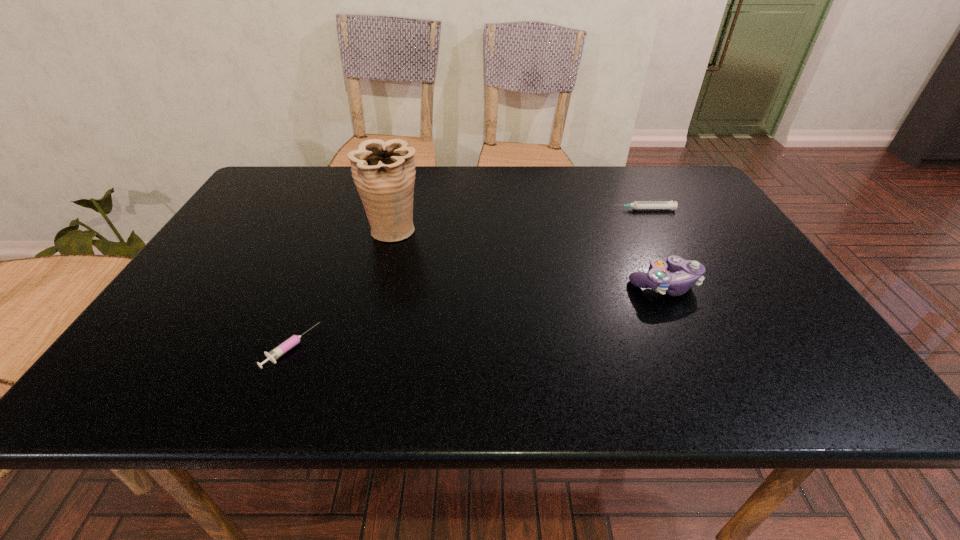
You are a GUI agent. You are given a task and a screenshot of the screen. Output one action in this format:
    pyautogui.click(x=<x>, y=<y>)
    Task: Click on the free space between the farther syringe and the nearest object
    Image resolution: width=960 pixels, height=540 pixels.
    Given the screenshot: What is the action you would take?
    pyautogui.click(x=468, y=278)

Select which object appears as the closest to the third shortest object. Please provide its 2D coordinates. Your answer should be formatted as a tuple, i.e. [(x, y)], where the tuple contains the x and y coordinates of a point satisfying the conditions above.

[(672, 205)]

At what (x,y) coordinates should I click in order to perform the action: click on the second closest object to the shortest object. Please return your answer as a coordinate pair (x, y). The width and height of the screenshot is (960, 540). Looking at the image, I should click on (685, 273).

You are a GUI agent. You are given a task and a screenshot of the screen. Output one action in this format:
    pyautogui.click(x=<x>, y=<y>)
    Task: Click on the vacant area that satisfies the following two spatial constraints: 1. on the front side of the third farthest object; 2. on the left side of the second farthest object
    
    Given the screenshot: What is the action you would take?
    pyautogui.click(x=379, y=285)